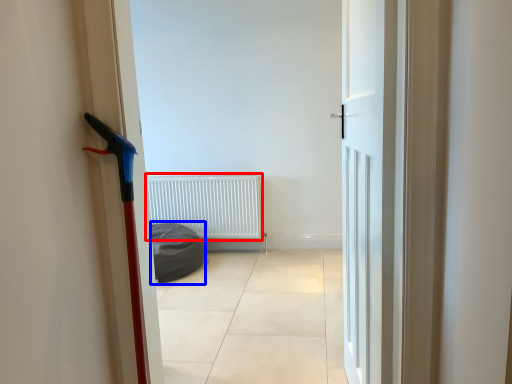
Question: Which object appears farthest to the camera in this image, radiator (highlighted by a red box) or sleeping bag (highlighted by a blue box)?

Choices:
 (A) radiator
 (B) sleeping bag

Answer: (A)